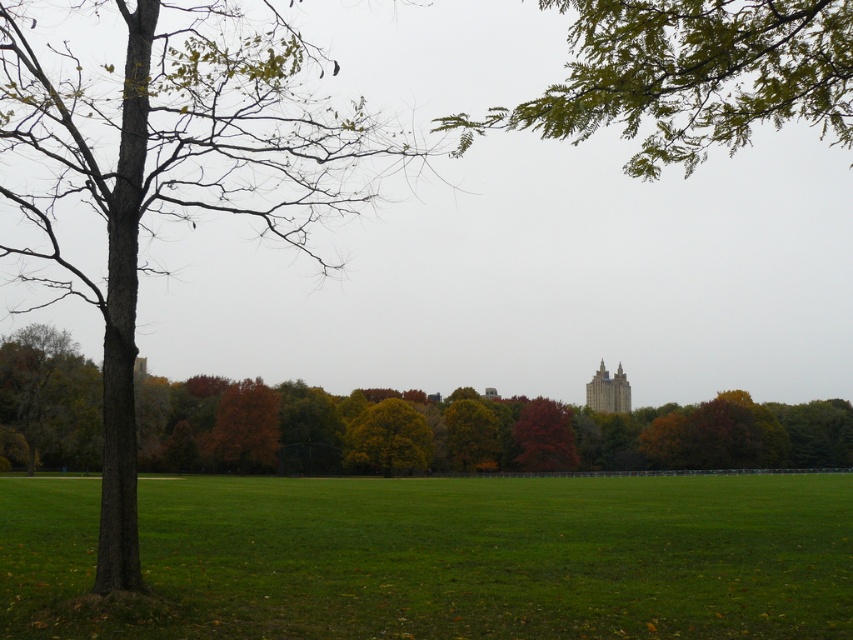
Question: Where is green grass at center located in relation to smooth gray stone tower at center in the image?

Choices:
 (A) left
 (B) right

Answer: (A)

Question: From the image, what is the correct spatial relationship of green leafy branches at upper center in relation to green leafy tree at center?

Choices:
 (A) above
 (B) below

Answer: (A)

Question: Which of the following is the farthest from the observer?

Choices:
 (A) (134, 180)
 (B) (605, 376)

Answer: (B)

Question: Is the position of green grass at center more distant than that of brown rough bark tree at left?

Choices:
 (A) yes
 (B) no

Answer: (A)

Question: Estimate the real-world distances between objects in this image. Which object is closer to the shiny red tree at center?

Choices:
 (A) green leafy branches at upper center
 (B) green matte tree at left

Answer: (B)

Question: Which point appears farthest from the camera in this image?

Choices:
 (A) (564, 433)
 (B) (225, 3)
 (C) (585, 17)
 (D) (746, 467)

Answer: (D)